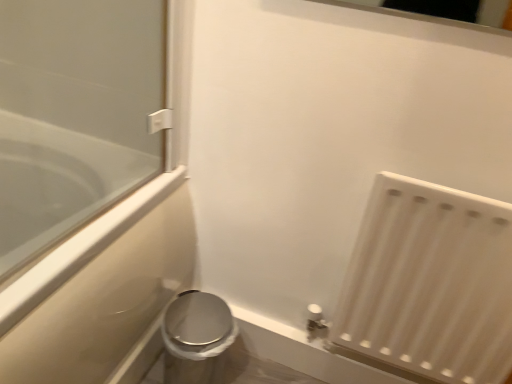
Question: Visually, is white matte radiator at lower right positioned to the left or to the right of clear glass bathtub at left?

Choices:
 (A) right
 (B) left

Answer: (A)

Question: Is white matte radiator at lower right taller or shorter than clear glass bathtub at left?

Choices:
 (A) tall
 (B) short

Answer: (B)

Question: Considering the real-world distances, which object is farthest from the satin silver toilet at lower left?

Choices:
 (A) clear glass bathtub at left
 (B) white matte radiator at lower right

Answer: (B)

Question: Which is farther from the satin silver toilet at lower left?

Choices:
 (A) white matte radiator at lower right
 (B) clear glass bathtub at left

Answer: (A)